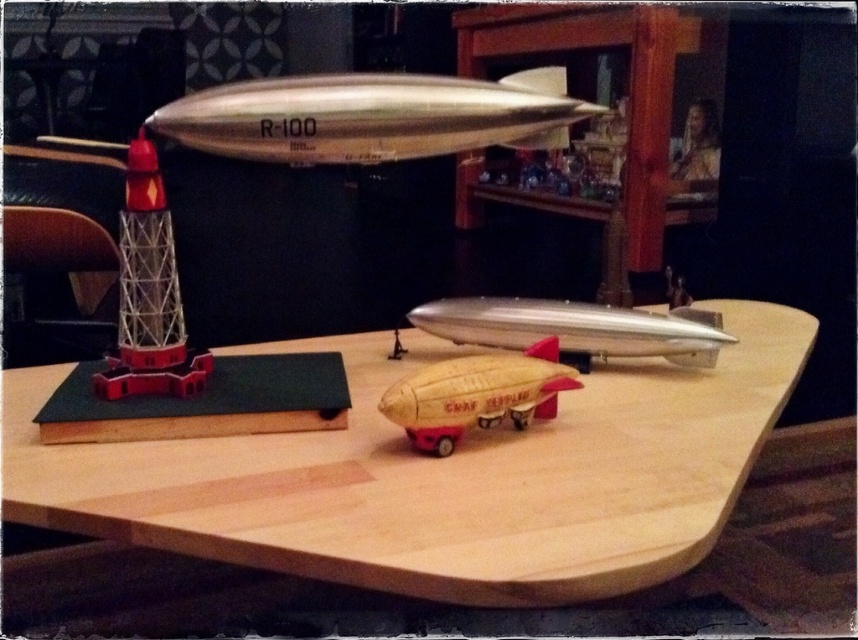
Where is the silver metallic airplane at center located in the image?

The silver metallic airplane at center is located at point (575,328) in the image.

You are looking at the wooden table with model airships. There is a silver metallic airplane at center and a beige rubber toy at center. Which object is positioned to the right of the other?

The silver metallic airplane at center is to the right of the beige rubber toy at center.

You are organizing a toy store display and see the metallic lattice tower at left and the beige rubber toy at center. Which toy is located to the left of the other?

The metallic lattice tower at left is positioned on the left side of the beige rubber toy at center.